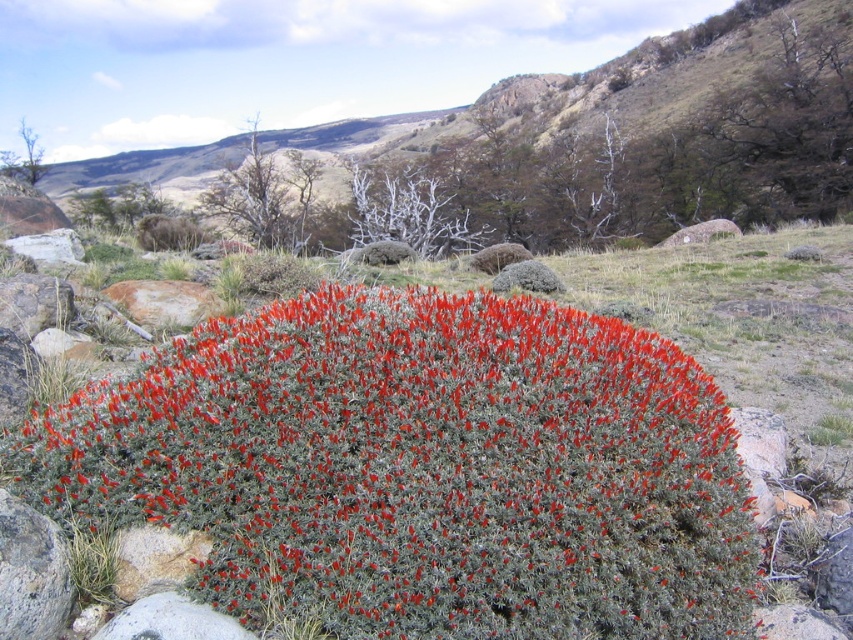
Question: Which point is closer to the camera?

Choices:
 (A) (509, 212)
 (B) (367, 588)

Answer: (B)

Question: Which object is closer to the camera taking this photo?

Choices:
 (A) green grassy hillside at center
 (B) red fuzzy bush at center

Answer: (B)

Question: Does red fuzzy bush at center have a smaller size compared to green grassy hillside at center?

Choices:
 (A) yes
 (B) no

Answer: (A)

Question: Is red fuzzy bush at center further to the viewer compared to green grassy hillside at center?

Choices:
 (A) no
 (B) yes

Answer: (A)

Question: Is red fuzzy bush at center below green grassy hillside at center?

Choices:
 (A) yes
 (B) no

Answer: (A)